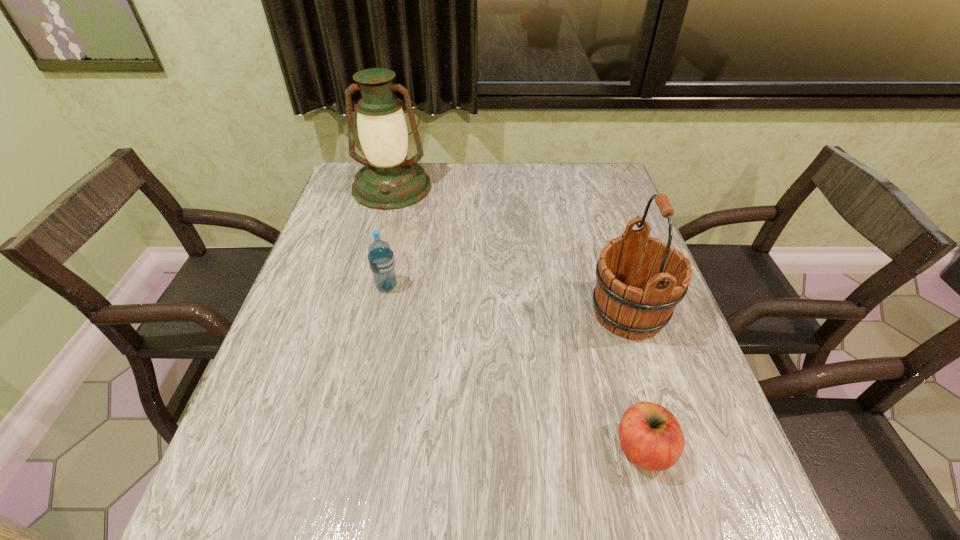
Identify the location of object present at the left edge. The height and width of the screenshot is (540, 960). (388, 181).

What are the coordinates of `wine bucket positioned at the right edge` in the screenshot? It's located at (638, 299).

Find the location of a particular element. This screenshot has height=540, width=960. apple positioned at the right edge is located at coordinates (650, 436).

Locate an element on the screen. The width and height of the screenshot is (960, 540). object at the far left corner is located at coordinates (388, 181).

This screenshot has width=960, height=540. Find the location of `vacant space at the far edge`. vacant space at the far edge is located at coordinates (431, 199).

Where is `free space at the left edge`? free space at the left edge is located at coordinates tap(321, 299).

The width and height of the screenshot is (960, 540). I want to click on free space at the far right corner of the desktop, so click(x=621, y=193).

I want to click on free space between the wine bucket and the apple, so click(636, 381).

At what (x,y) coordinates should I click in order to perform the action: click on vacant area that lies between the lantern and the wine bucket. Please return your answer as a coordinate pair (x, y). Image resolution: width=960 pixels, height=540 pixels. Looking at the image, I should click on (510, 250).

Locate an element on the screen. This screenshot has height=540, width=960. vacant area that lies between the second shortest object and the wine bucket is located at coordinates (508, 300).